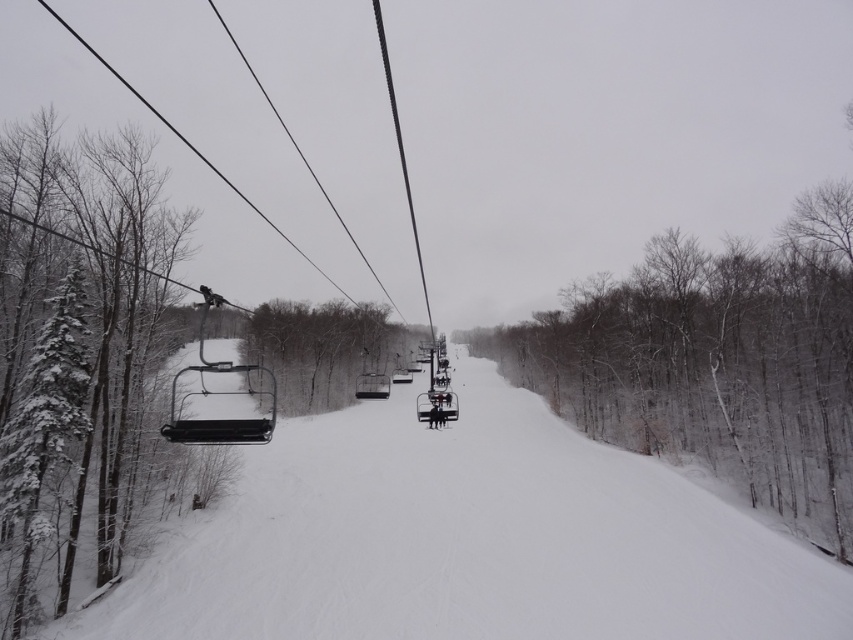
From the picture: Who is positioned more to the left, snowy bark trees at center or snow-covered evergreen at left?

From the viewer's perspective, snow-covered evergreen at left appears more on the left side.

Between point (770, 499) and point (19, 406), which one is positioned in front?

Positioned in front is point (19, 406).

Does point (704, 288) come behind point (83, 374)?

Yes, it is behind point (83, 374).

Where is `snowy bark trees at center`? The height and width of the screenshot is (640, 853). snowy bark trees at center is located at coordinates click(x=717, y=360).

Image resolution: width=853 pixels, height=640 pixels. Describe the element at coordinates (74, 337) in the screenshot. I see `snow-covered evergreen tree at left` at that location.

Does snow-covered evergreen tree at left appear under snow-covered branches at center?

No, snow-covered evergreen tree at left is not below snow-covered branches at center.

Image resolution: width=853 pixels, height=640 pixels. I want to click on snow-covered evergreen tree at left, so click(74, 337).

Can you confirm if white snow at center is positioned to the left of snowy bark trees at center?

Correct, you'll find white snow at center to the left of snowy bark trees at center.

Is white snow at center below snowy bark trees at center?

Indeed, white snow at center is positioned under snowy bark trees at center.

What are the coordinates of `white snow at center` in the screenshot? It's located at (466, 540).

Locate an element on the screen. The image size is (853, 640). white snow at center is located at coordinates (466, 540).